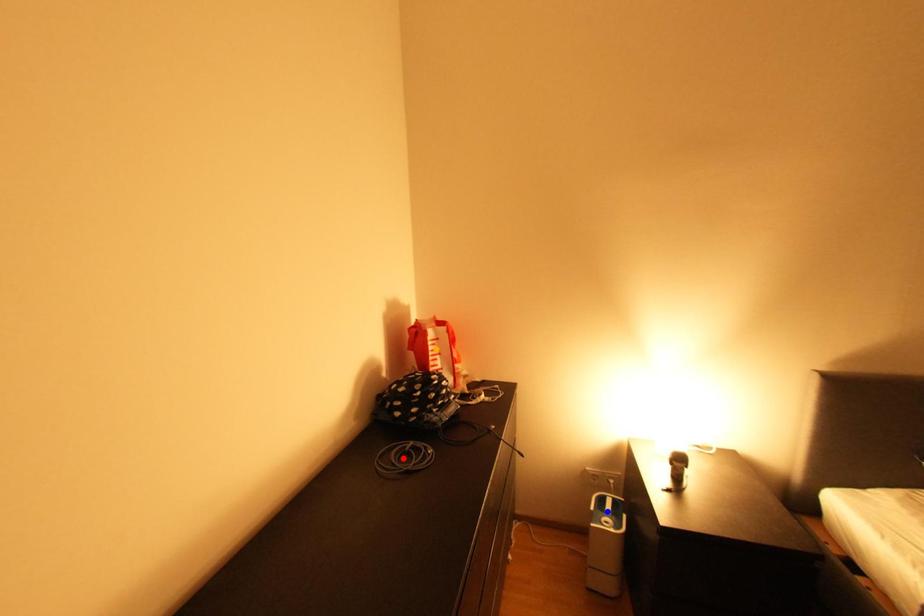
Order these from farthest to nearest:
orange point
red point
blue point

1. blue point
2. orange point
3. red point